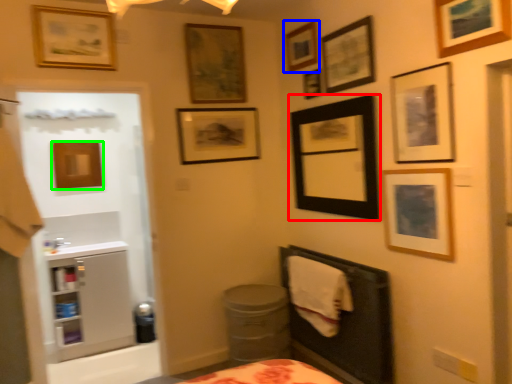
Question: Which is farther away from picture frame (highlighted by a red box)? picture frame (highlighted by a blue box) or picture frame (highlighted by a green box)?

Choices:
 (A) picture frame
 (B) picture frame

Answer: (B)